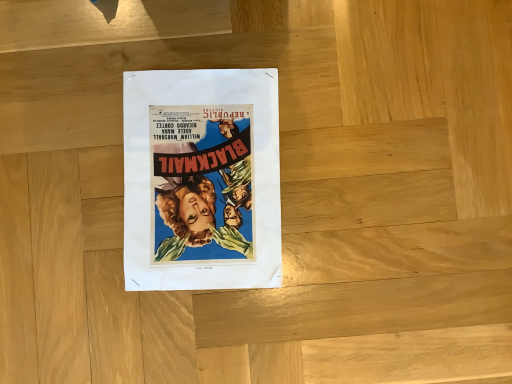
Find the location of a particular element. vacant area on top of matte paper poster at center (from a real-world perspective) is located at coordinates (199, 174).